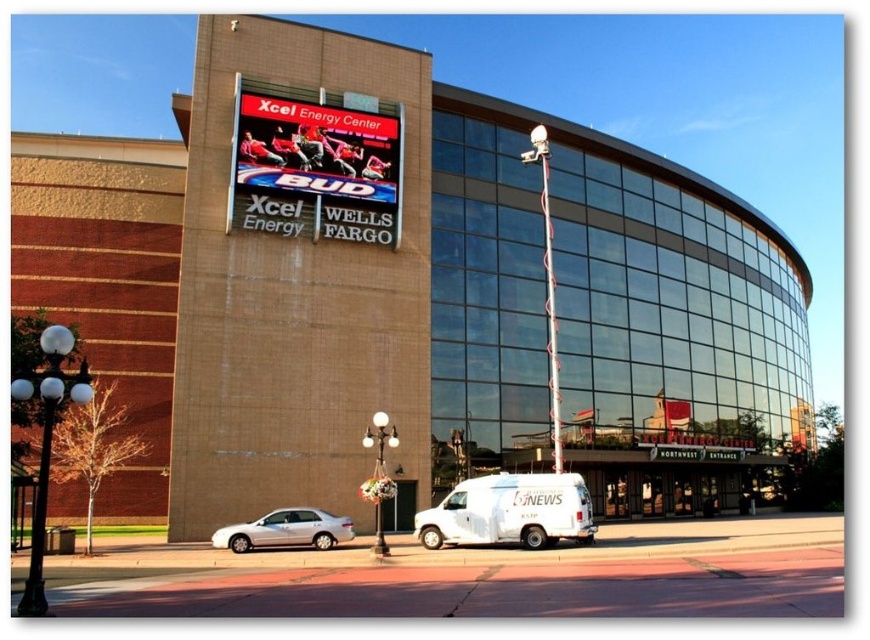
Which is in front, point (492, 529) or point (246, 524)?

Positioned in front is point (492, 529).

Can you confirm if white matte van at lower center is positioned above silver metallic sedan at lower left?

Yes, white matte van at lower center is above silver metallic sedan at lower left.

I want to click on white matte van at lower center, so click(509, 512).

The image size is (870, 640). Describe the element at coordinates (285, 531) in the screenshot. I see `silver metallic sedan at lower left` at that location.

Can you confirm if silver metallic sedan at lower left is positioned to the right of metallic spiral pole at upper center?

Incorrect, silver metallic sedan at lower left is not on the right side of metallic spiral pole at upper center.

What do you see at coordinates (285, 531) in the screenshot? Image resolution: width=870 pixels, height=640 pixels. I see `silver metallic sedan at lower left` at bounding box center [285, 531].

The width and height of the screenshot is (870, 640). What are the coordinates of `silver metallic sedan at lower left` in the screenshot? It's located at (285, 531).

Who is shorter, white matte van at lower center or metallic spiral pole at upper center?

white matte van at lower center is shorter.

Can you confirm if white matte van at lower center is shorter than metallic spiral pole at upper center?

Yes, white matte van at lower center is shorter than metallic spiral pole at upper center.

This screenshot has width=870, height=640. I want to click on white matte van at lower center, so click(509, 512).